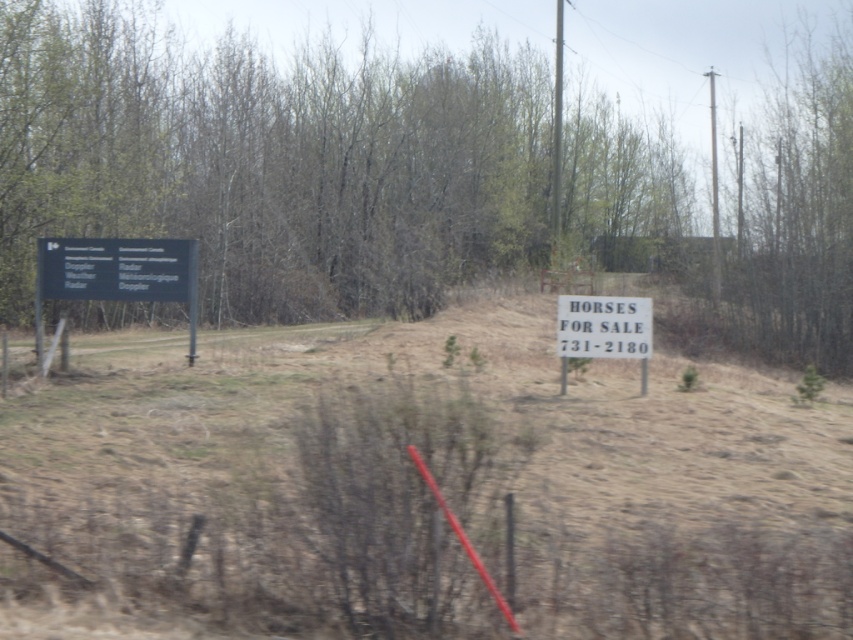
Does white paper sign at center have a lesser height compared to white paper sign at right?

In fact, white paper sign at center may be taller than white paper sign at right.

Who is more distant from viewer, (x=167, y=614) or (x=579, y=344)?

The point (x=579, y=344) is behind.

Where is `white paper sign at center`? The width and height of the screenshot is (853, 640). white paper sign at center is located at coordinates (421, 490).

Between white paper sign at center and green leafy tree at upper center, which one appears on the left side from the viewer's perspective?

From the viewer's perspective, green leafy tree at upper center appears more on the left side.

In the scene shown: Can you confirm if white paper sign at center is positioned to the right of green leafy tree at upper center?

Indeed, white paper sign at center is positioned on the right side of green leafy tree at upper center.

In order to click on white paper sign at center in this screenshot , I will do `click(421, 490)`.

Looking at this image, who is taller, green leafy tree at upper center or black plastic sign at left?

green leafy tree at upper center

Can you confirm if green leafy tree at upper center is positioned to the right of black plastic sign at left?

Correct, you'll find green leafy tree at upper center to the right of black plastic sign at left.

Which is in front, point (39, 209) or point (120, 244)?

Point (120, 244)

This screenshot has width=853, height=640. Find the location of `green leafy tree at upper center`. green leafy tree at upper center is located at coordinates (271, 163).